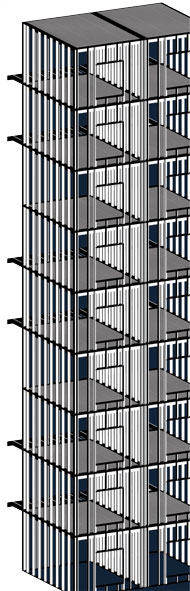
You are a GUI agent. You are given a task and a screenshot of the screen. Output one action in this format:
    pyautogui.click(x=<x>, y=<y>)
    Task: Click on the fifth floor rooms
    The image size is (190, 591).
    Given the screenshot: What is the action you would take?
    pyautogui.click(x=91, y=333), pyautogui.click(x=173, y=321)